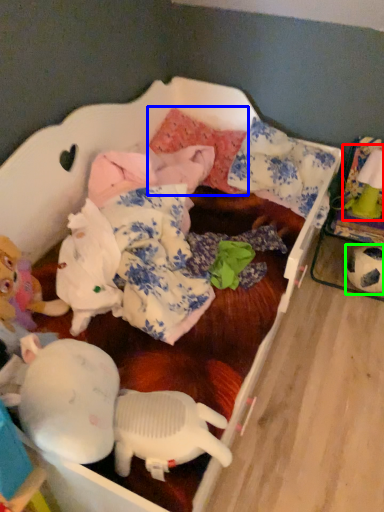
Question: Based on their relative distances, which object is farther from toy (highlighted by a red box)? Choose from pillow (highlighted by a blue box) and toy (highlighted by a green box).

Choices:
 (A) pillow
 (B) toy

Answer: (A)